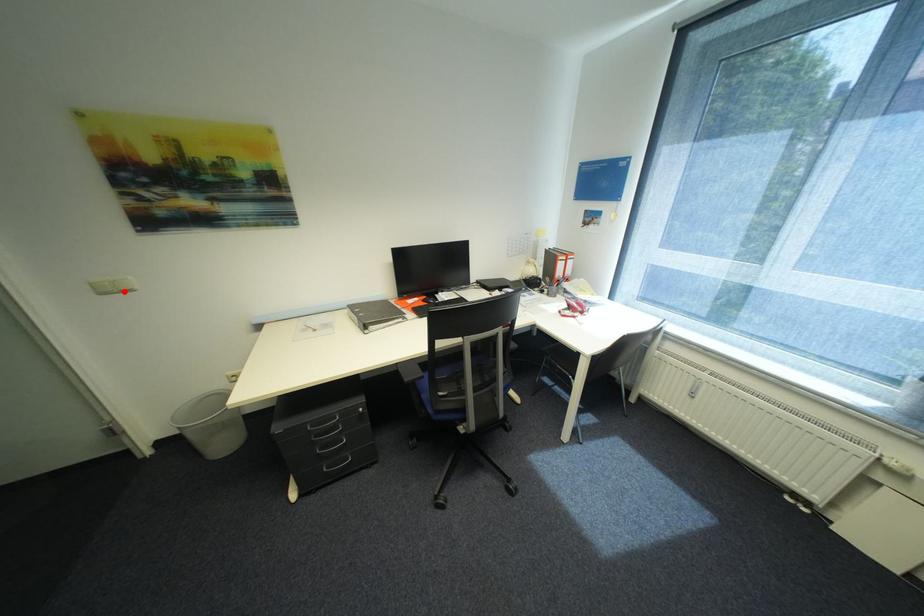
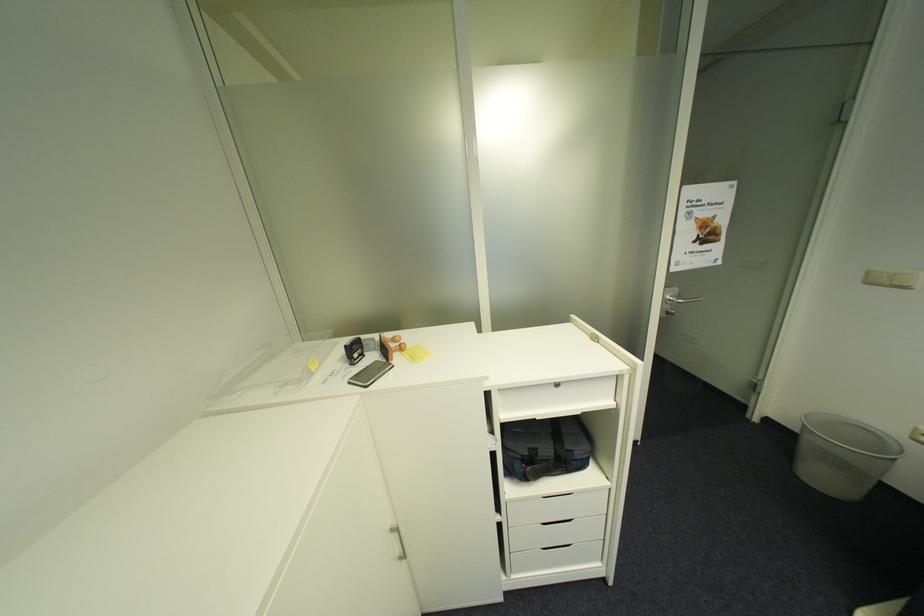
Question: I am providing you with two images of the same scene from different viewpoints. In image1, a red point is highlighted. Considering the same 3D point in image2, which of the following is correct?

Choices:
 (A) It is closer
 (B) It is farther

Answer: (B)